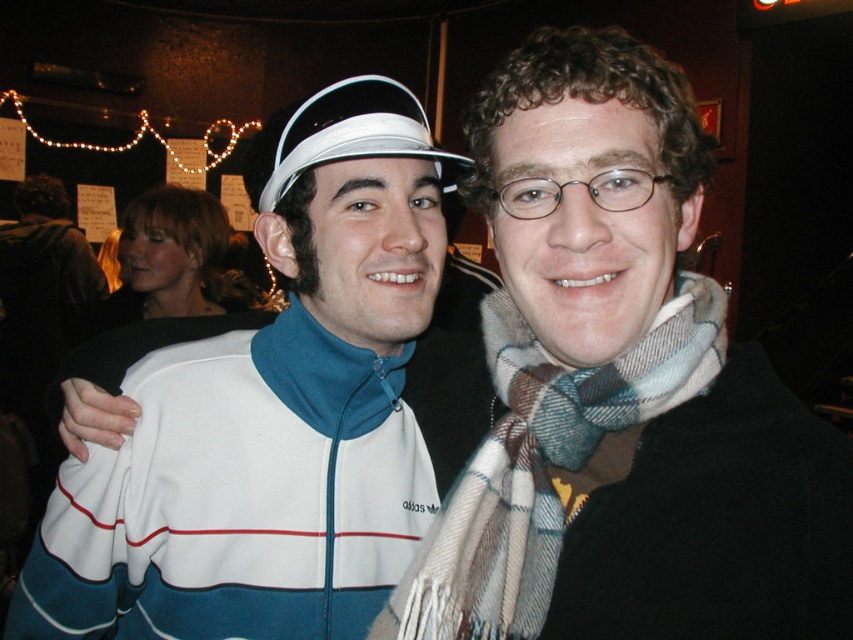
You are taking a photo of two people. You notice the plaid wool scarf at right and the white fabric visor at upper center. Which object is closer to the bottom of the image?

The plaid wool scarf at right is positioned under the white fabric visor at upper center, so it is closer to the bottom of the image.